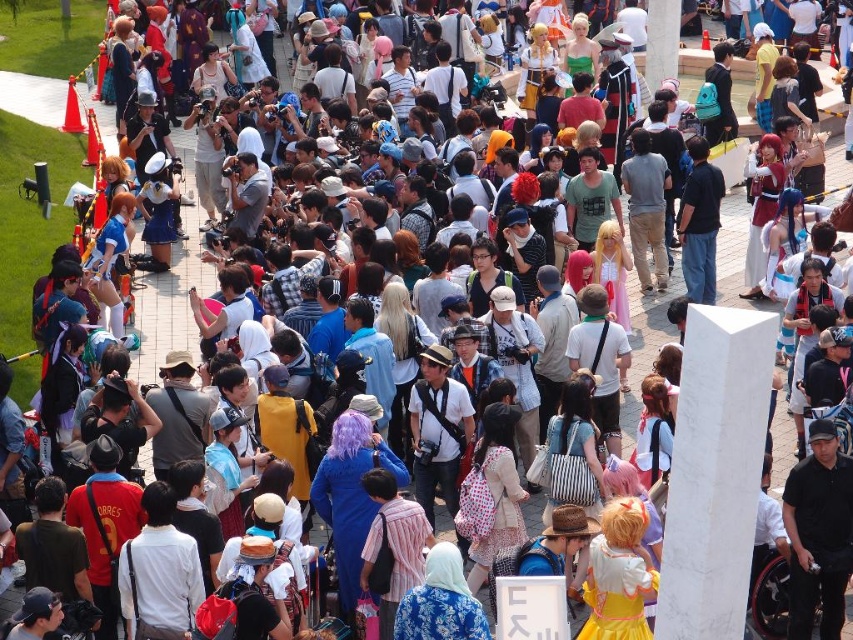
Which is behind, point (723, 627) or point (830, 528)?

Point (830, 528)

Can you confirm if white marble pillar at center is taller than black cotton shirt at center?

No, white marble pillar at center is not taller than black cotton shirt at center.

Is point (709, 307) closer to camera compared to point (827, 497)?

Yes, point (709, 307) is closer to viewer.

Locate an element on the screen. This screenshot has height=640, width=853. white marble pillar at center is located at coordinates click(x=715, y=472).

Can you confirm if black cotton shirt at center is positioned below dark blue shirt at center?

Yes.

Is black cotton shirt at center further to the viewer compared to dark blue shirt at center?

No, it is in front of dark blue shirt at center.

Which is behind, point (811, 465) or point (708, 280)?

Point (708, 280)

Identify the location of black cotton shirt at center. (817, 532).

Is white marble pillar at center above dark blue shirt at center?

Incorrect, white marble pillar at center is not positioned above dark blue shirt at center.

Who is more forward, (724, 614) or (685, 202)?

Point (724, 614) is in front.

You are a GUI agent. You are given a task and a screenshot of the screen. Output one action in this format:
    pyautogui.click(x=<x>, y=<y>)
    Task: Click on the white marble pillar at center
    The image size is (853, 640).
    Given the screenshot: What is the action you would take?
    pyautogui.click(x=715, y=472)